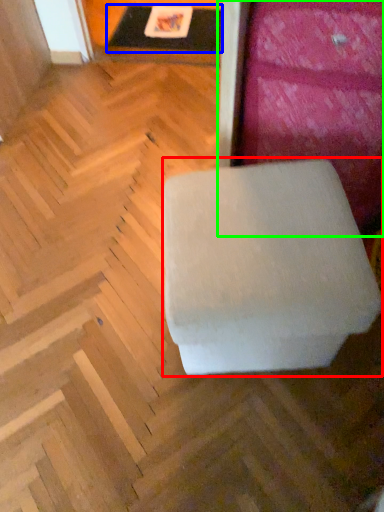
Question: Based on their relative distances, which object is farther from furniture (highlighted by a red box)? Choose from table (highlighted by a blue box) and furniture (highlighted by a green box).

Choices:
 (A) table
 (B) furniture

Answer: (A)